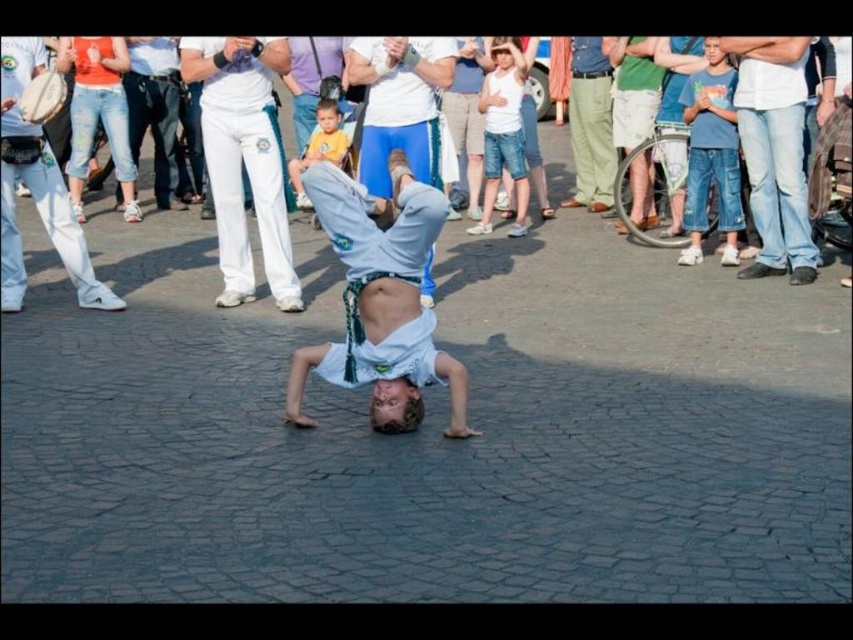
You are a photographer trying to capture the boy performing the handstand. You notice the white cotton pants at center and the white fabric shirt at center. Which clothing item will appear larger in your photo?

The white cotton pants at center will appear larger in the photo because it has a larger size compared to the white fabric shirt at center.

You are a photographer trying to capture the boy performing the handstand. You notice two items in the background that might distract from the main subject. The items are the jeans at right and the yellow cotton shirt at center. Which of these items is larger and would require more attention in your composition to avoid distraction?

The jeans at right is bigger than the yellow cotton shirt at center, so it would require more attention in your composition to avoid distraction.